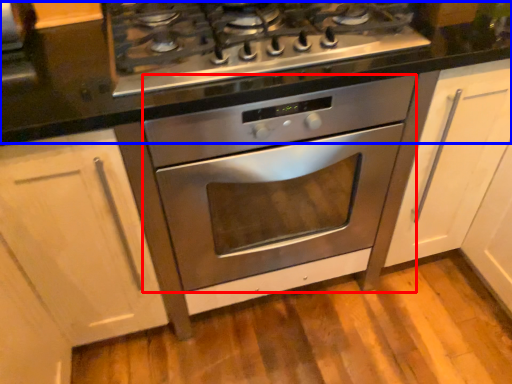
Question: Which point is closer to the camera, oven (highlighted by a red box) or counter top (highlighted by a blue box)?

Choices:
 (A) oven
 (B) counter top

Answer: (B)